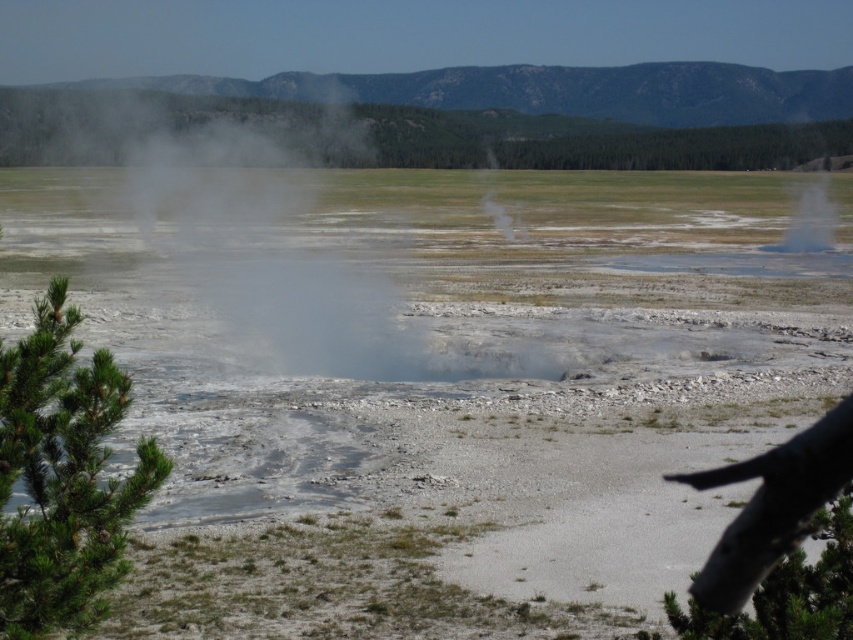
Can you confirm if green matte tree at lower left is shorter than white vapor at center?

Indeed, green matte tree at lower left has a lesser height compared to white vapor at center.

Can you confirm if green matte tree at lower left is positioned to the right of white vapor at center?

Incorrect, green matte tree at lower left is not on the right side of white vapor at center.

Is point (15, 620) farther from viewer compared to point (489, 195)?

No.

Where is `green matte tree at lower left`? Image resolution: width=853 pixels, height=640 pixels. green matte tree at lower left is located at coordinates (62, 476).

In the scene shown: Does green rough bark branch at lower right have a lesser width compared to white vapor at center?

No, green rough bark branch at lower right is not thinner than white vapor at center.

Measure the distance between green rough bark branch at lower right and white vapor at center.

green rough bark branch at lower right is 61.27 meters from white vapor at center.

Is point (836, 531) closer to camera compared to point (492, 204)?

Yes, point (836, 531) is in front of point (492, 204).

At what (x,y) coordinates should I click in order to perform the action: click on green rough bark branch at lower right. Please return your answer as a coordinate pair (x, y). This screenshot has height=640, width=853. Looking at the image, I should click on (779, 544).

Is point (106, 522) behind point (824, 632)?

That is True.

Does green matte tree at lower left appear on the right side of green rough bark branch at lower right?

No, green matte tree at lower left is not to the right of green rough bark branch at lower right.

Where is `green matte tree at lower left`? The height and width of the screenshot is (640, 853). green matte tree at lower left is located at coordinates (62, 476).